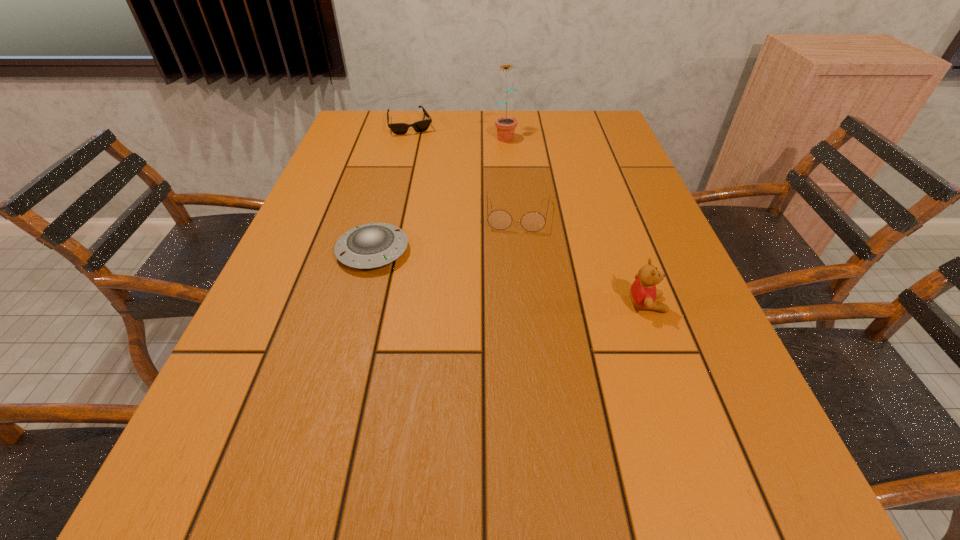
The width and height of the screenshot is (960, 540). What are the coordinates of `blank area located 0.110m on the flower of the tallest object` in the screenshot? It's located at (511, 161).

Where is `free spot located on the temples of the spectacles`? The height and width of the screenshot is (540, 960). free spot located on the temples of the spectacles is located at coordinates (513, 320).

The height and width of the screenshot is (540, 960). What are the coordinates of `vacant space located on the temples of the spectacles` in the screenshot? It's located at (511, 344).

You are a GUI agent. You are given a task and a screenshot of the screen. Output one action in this format:
    pyautogui.click(x=<x>, y=<y>)
    Task: Click on the free spot located 0.160m on the temples of the spectacles
    The height and width of the screenshot is (540, 960).
    Given the screenshot: What is the action you would take?
    pyautogui.click(x=516, y=278)

The width and height of the screenshot is (960, 540). I want to click on blank area located on the front-facing side of the sunglasses, so click(423, 162).

The height and width of the screenshot is (540, 960). I want to click on vacant point located on the front-facing side of the sunglasses, so click(x=434, y=191).

Find the location of a particular element. Image resolution: width=960 pixels, height=540 pixels. blank space located on the front-facing side of the sunglasses is located at coordinates (431, 183).

Where is `sunflower that is at the far edge`? The width and height of the screenshot is (960, 540). sunflower that is at the far edge is located at coordinates (506, 125).

The width and height of the screenshot is (960, 540). Identify the location of sunglasses that is at the far edge. (420, 126).

Locate an element on the screen. Image resolution: width=960 pixels, height=540 pixels. saucer positioned at the left edge is located at coordinates (372, 245).